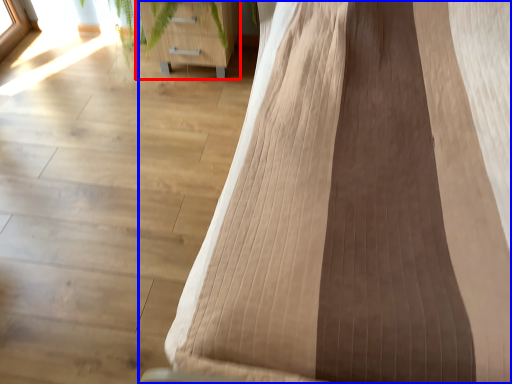
Question: Which point is closer to the camera, furniture (highlighted by a red box) or furniture (highlighted by a blue box)?

Choices:
 (A) furniture
 (B) furniture

Answer: (B)